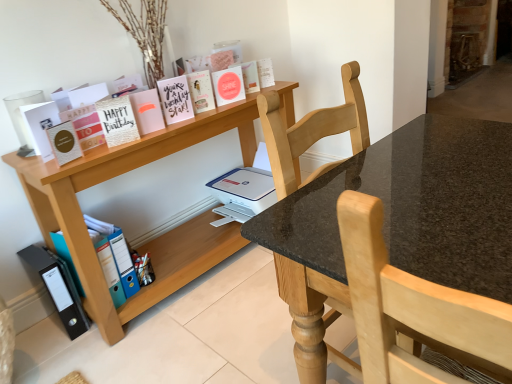
Question: Would you say matte pink card at upper center, the 4th paperback book when ordered from right to left, is outside gold textured card at upper left, which is the seventh paperback book in right-to-left order?

Choices:
 (A) no
 (B) yes

Answer: (B)

Question: Would you say matte pink card at upper center, placed as the seventh paperback book when sorted from left to right, contains gold textured card at upper left, marked as the 4th paperback book in a left-to-right arrangement?

Choices:
 (A) yes
 (B) no

Answer: (B)

Question: Can you confirm if matte pink card at upper center, placed as the seventh paperback book when sorted from left to right, is wider than gold textured card at upper left, which is the seventh paperback book in right-to-left order?

Choices:
 (A) yes
 (B) no

Answer: (B)

Question: Considering the relative sizes of matte pink card at upper center, placed as the seventh paperback book when sorted from left to right, and gold textured card at upper left, marked as the 4th paperback book in a left-to-right arrangement, in the image provided, is matte pink card at upper center, placed as the seventh paperback book when sorted from left to right, smaller than gold textured card at upper left, marked as the 4th paperback book in a left-to-right arrangement,?

Choices:
 (A) yes
 (B) no

Answer: (A)

Question: From a real-world perspective, is matte pink card at upper center, placed as the seventh paperback book when sorted from left to right, beneath gold textured card at upper left, marked as the 4th paperback book in a left-to-right arrangement?

Choices:
 (A) no
 (B) yes

Answer: (B)

Question: Is point (65, 162) closer or farther from the camera than point (161, 125)?

Choices:
 (A) farther
 (B) closer

Answer: (B)

Question: Is matte gold card at left, which ranks as the ninth paperback book in right-to-left order, spatially inside pink matte card at upper center, marked as the sixth paperback book in a right-to-left arrangement, or outside of it?

Choices:
 (A) outside
 (B) inside

Answer: (A)

Question: In the image, is matte gold card at left, placed as the 2th paperback book when sorted from left to right, on the left side or the right side of pink matte card at upper center, which appears as the 5th paperback book when viewed from the left?

Choices:
 (A) right
 (B) left

Answer: (B)

Question: In the image, is matte gold card at left, placed as the 2th paperback book when sorted from left to right, positioned in front of or behind pink matte card at upper center, marked as the sixth paperback book in a right-to-left arrangement?

Choices:
 (A) front
 (B) behind

Answer: (A)

Question: From the image's perspective, is pink matte card at upper center, marked as the sixth paperback book in a right-to-left arrangement, positioned above or below matte pink paperback book at center, which is the third paperback book from right to left?

Choices:
 (A) above
 (B) below

Answer: (B)

Question: From their relative heights in the image, would you say pink matte card at upper center, which appears as the 5th paperback book when viewed from the left, is taller or shorter than matte pink paperback book at center, arranged as the 8th paperback book when viewed from the left?

Choices:
 (A) tall
 (B) short

Answer: (A)

Question: Considering the positions of point coord(158,122) and point coord(219,92), is point coord(158,122) closer or farther from the camera than point coord(219,92)?

Choices:
 (A) farther
 (B) closer

Answer: (B)

Question: Looking at the image, does pink matte card at upper center, marked as the sixth paperback book in a right-to-left arrangement, seem bigger or smaller compared to matte pink paperback book at center, arranged as the 8th paperback book when viewed from the left?

Choices:
 (A) big
 (B) small

Answer: (B)

Question: From a real-world perspective, relative to gold textured card at upper left, marked as the 4th paperback book in a left-to-right arrangement, is hardcover book at upper center, the 10th paperback book in the left-to-right sequence, vertically above or below?

Choices:
 (A) above
 (B) below

Answer: (B)

Question: Would you say hardcover book at upper center, which appears as the 1th paperback book when viewed from the right, is inside or outside gold textured card at upper left, which is the seventh paperback book in right-to-left order?

Choices:
 (A) outside
 (B) inside

Answer: (A)